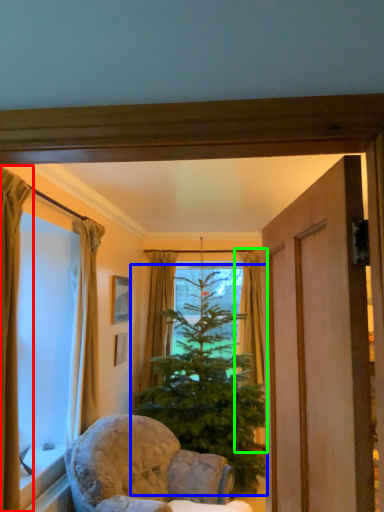
Question: Considering the real-world distances, which object is farthest from curtain (highlighted by a red box)? christmas tree (highlighted by a blue box) or curtain (highlighted by a green box)?

Choices:
 (A) christmas tree
 (B) curtain

Answer: (B)